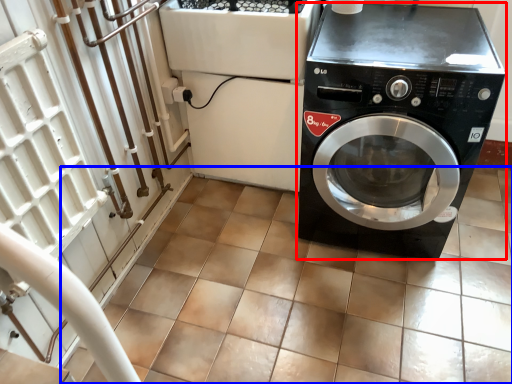
Question: Among these objects, which one is nearest to the camera, washing machine (highlighted by a red box) or tile (highlighted by a blue box)?

Choices:
 (A) washing machine
 (B) tile

Answer: (B)